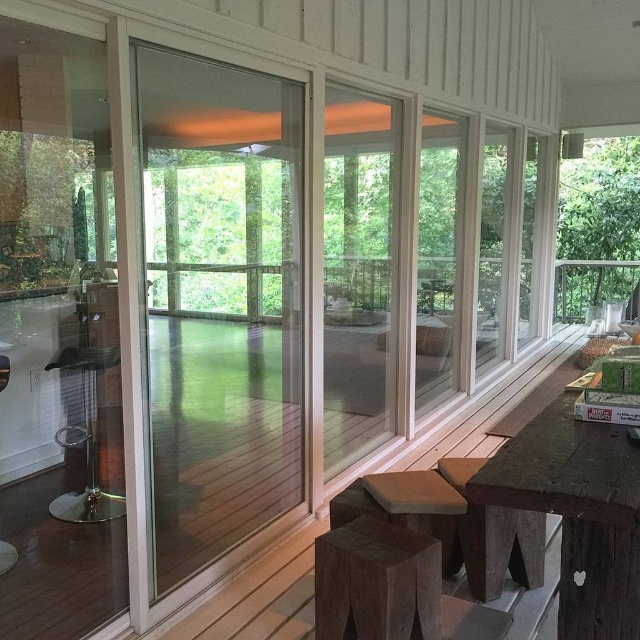
Which is more to the right, dark brown wooden stool at lower center or clear glass window at center?

From the viewer's perspective, clear glass window at center appears more on the right side.

Between point (429, 612) and point (461, 196), which one is positioned in front?

Point (429, 612) is more forward.

Identify the location of dark brown wooden stool at lower center. Image resolution: width=640 pixels, height=640 pixels. (376, 582).

Where is `dark brown wooden stool at lower center`? dark brown wooden stool at lower center is located at coordinates (376, 582).

Does dark brown wooden stool at lower center come behind clear glass window at right?

No, dark brown wooden stool at lower center is in front of clear glass window at right.

Find the location of a particular element. This screenshot has height=640, width=640. dark brown wooden stool at lower center is located at coordinates (376, 582).

Which of these two, clear glass window at right or black plastic stool at left, stands taller?

Standing taller between the two is clear glass window at right.

Is point (496, 250) positioned in front of point (58, 364)?

No.

This screenshot has height=640, width=640. Identify the location of clear glass window at right. (493, 244).